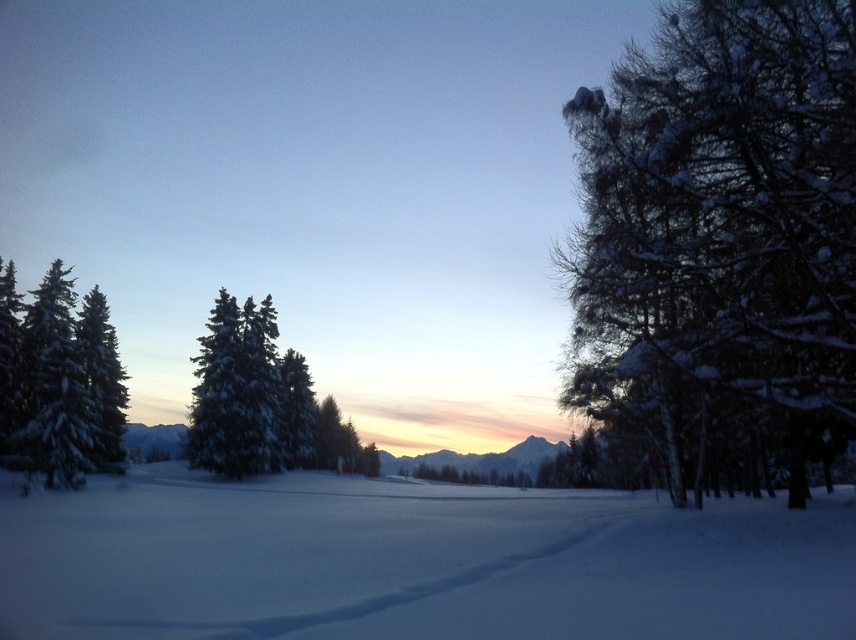
How far apart are snow-covered branches at right and snow-covered evergreen at center?

snow-covered branches at right is 41.46 meters away from snow-covered evergreen at center.

Is point (758, 65) positioned behind point (275, 397)?

No, it is not.

Which is in front, point (675, 184) or point (299, 385)?

Positioned in front is point (675, 184).

What are the coordinates of `snow-covered branches at right` in the screenshot? It's located at (718, 234).

Can you confirm if snow-covered branches at right is bigger than white snow-covered tree at left?

Yes.

Does point (717, 360) come behind point (54, 470)?

No, (717, 360) is in front of (54, 470).

The width and height of the screenshot is (856, 640). Find the location of `snow-covered branches at right`. snow-covered branches at right is located at coordinates (718, 234).

Does white fluffy snow at center have a greater width compared to white snow-covered tree at left?

Yes.

Can you confirm if white fluffy snow at center is bigger than white snow-covered tree at left?

Yes.

Who is more forward, (452, 602) or (34, 396)?

Point (452, 602) is in front.

Where is `white fluffy snow at center`? white fluffy snow at center is located at coordinates (415, 563).